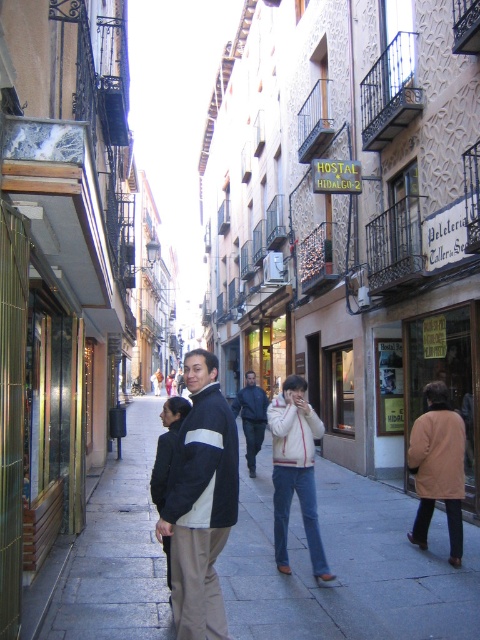
Does point (264, 564) lie behind point (261, 444)?

No, it is in front of (261, 444).

Does point (67, 627) lie in front of point (256, 426)?

Yes, it is.

The height and width of the screenshot is (640, 480). I want to click on smooth concrete sidewalk at center, so click(x=346, y=566).

Which is below, smooth concrete sidewalk at center or black jacket at center?

smooth concrete sidewalk at center is below.

Can you confirm if smooth concrete sidewalk at center is positioned above black jacket at center?

Actually, smooth concrete sidewalk at center is below black jacket at center.

What do you see at coordinates (346, 566) in the screenshot? I see `smooth concrete sidewalk at center` at bounding box center [346, 566].

Find the location of a particular element. The height and width of the screenshot is (640, 480). smooth concrete sidewalk at center is located at coordinates (346, 566).

Who is shorter, black jacket at center or dark blue jacket at center?

dark blue jacket at center

Image resolution: width=480 pixels, height=640 pixels. What are the coordinates of `black jacket at center` in the screenshot? It's located at (201, 500).

Locate an element on the screen. black jacket at center is located at coordinates (201, 500).